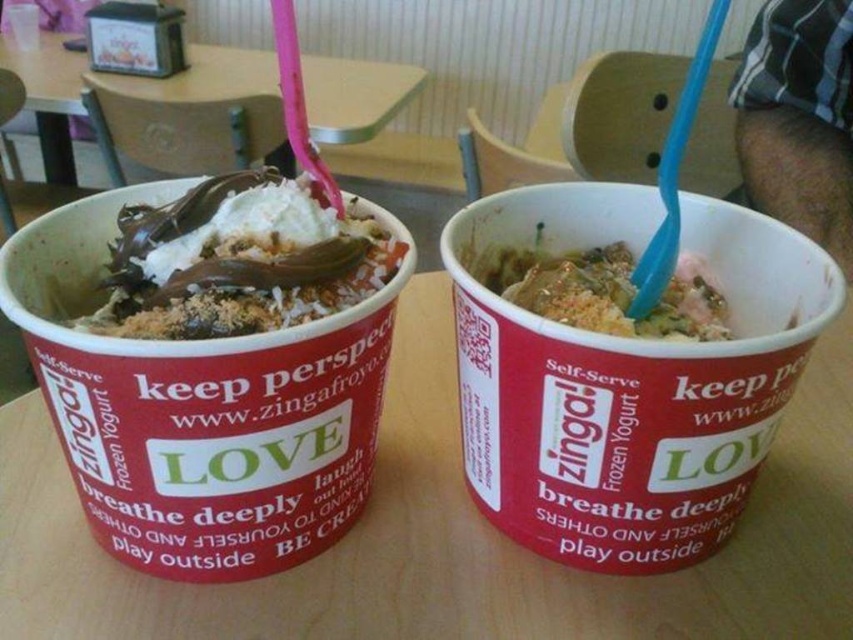
Question: Does chocolate-coated ice cream at left have a smaller size compared to crumbly brown topping at center?

Choices:
 (A) no
 (B) yes

Answer: (A)

Question: Which object is the closest to the crumbly brown topping at center?

Choices:
 (A) wooden table at center
 (B) wooden table at upper center

Answer: (A)

Question: Considering the relative positions of wooden table at center and chocolate-coated ice cream at left in the image provided, where is wooden table at center located with respect to chocolate-coated ice cream at left?

Choices:
 (A) above
 (B) below

Answer: (B)

Question: Does chocolate-coated ice cream at left lie behind crumbly brown topping at center?

Choices:
 (A) no
 (B) yes

Answer: (A)

Question: Estimate the real-world distances between objects in this image. Which object is farther from the wooden table at upper center?

Choices:
 (A) crumbly brown topping at center
 (B) chocolate-coated ice cream at left
 (C) wooden table at center

Answer: (A)

Question: Estimate the real-world distances between objects in this image. Which object is closer to the wooden table at center?

Choices:
 (A) crumbly brown topping at center
 (B) wooden table at upper center
 (C) chocolate-coated ice cream at left

Answer: (A)